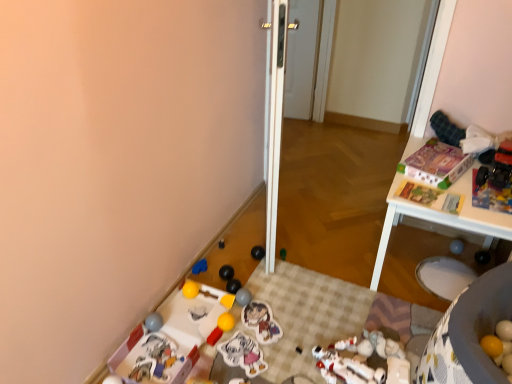
In order to click on vacant area that is in front of matte gray ball at center, which ranks as the 10th toy in right-to-left order in this screenshot , I will do `click(243, 337)`.